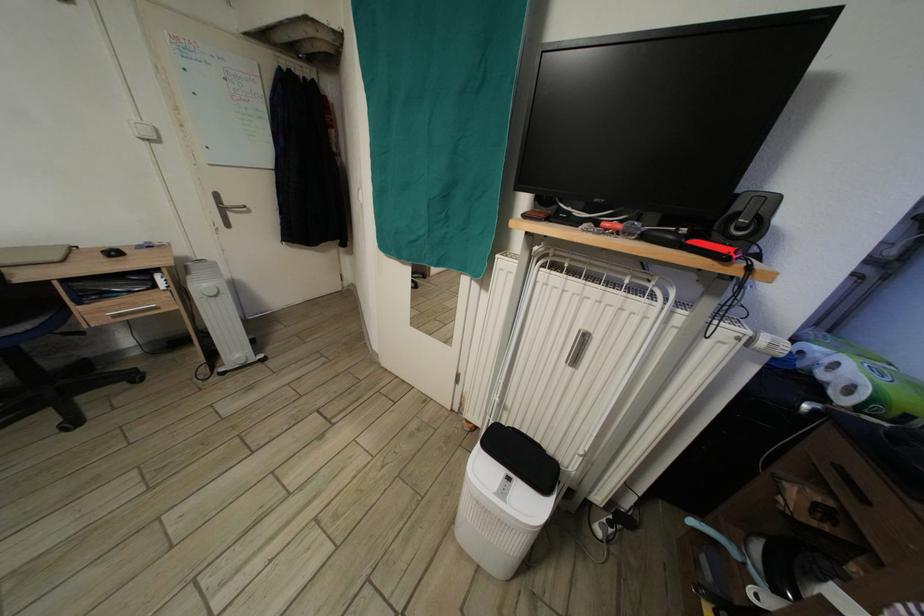
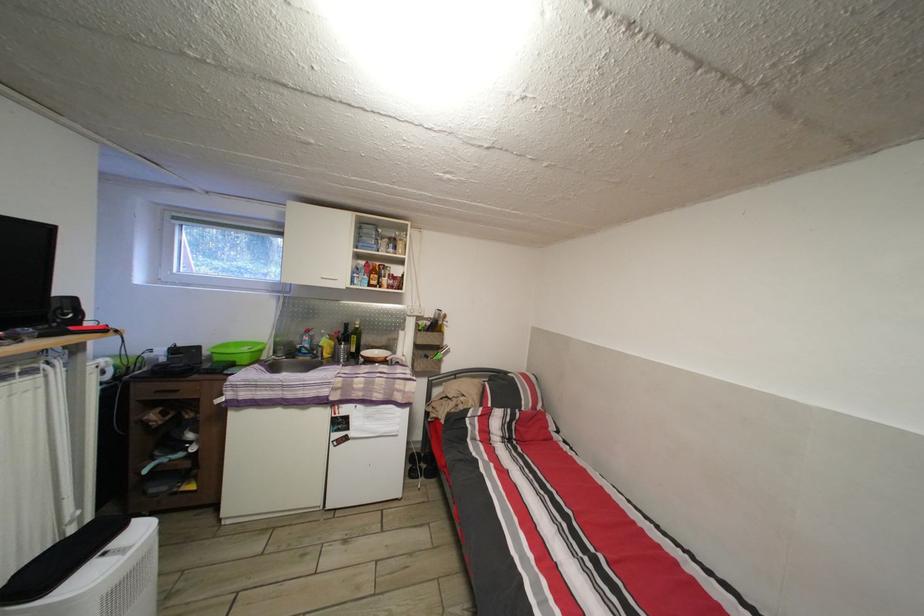
The point at [870,507] is marked in the first image. Where is the corresponding point in the second image?

(184, 398)